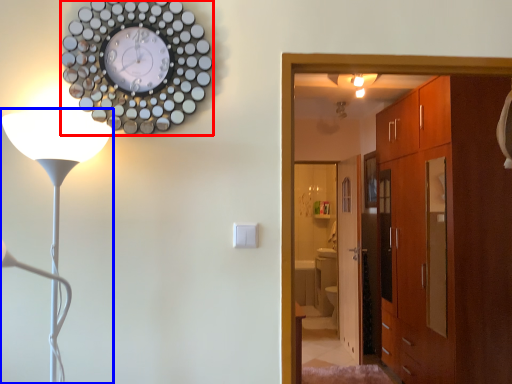
Question: Which object is further to the camera taking this photo, wall clock (highlighted by a red box) or lamp (highlighted by a blue box)?

Choices:
 (A) wall clock
 (B) lamp

Answer: (A)